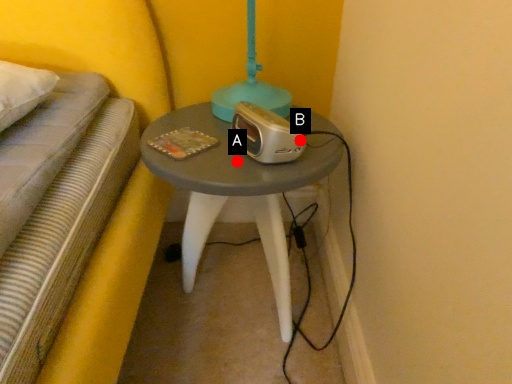
Question: Two points are circled on the image, labeled by A and B beside each circle. Which point is farther to the camera?

Choices:
 (A) A is further
 (B) B is further

Answer: (A)